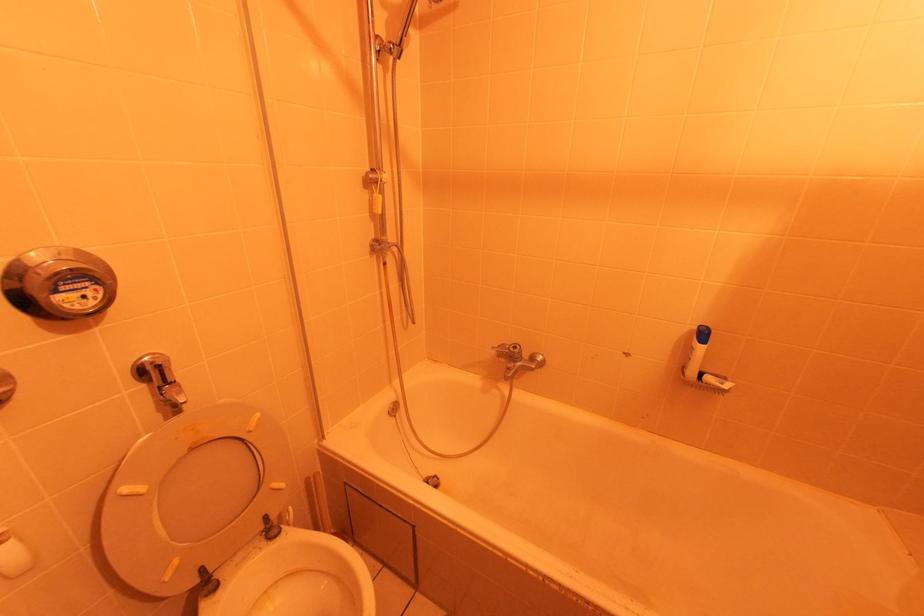
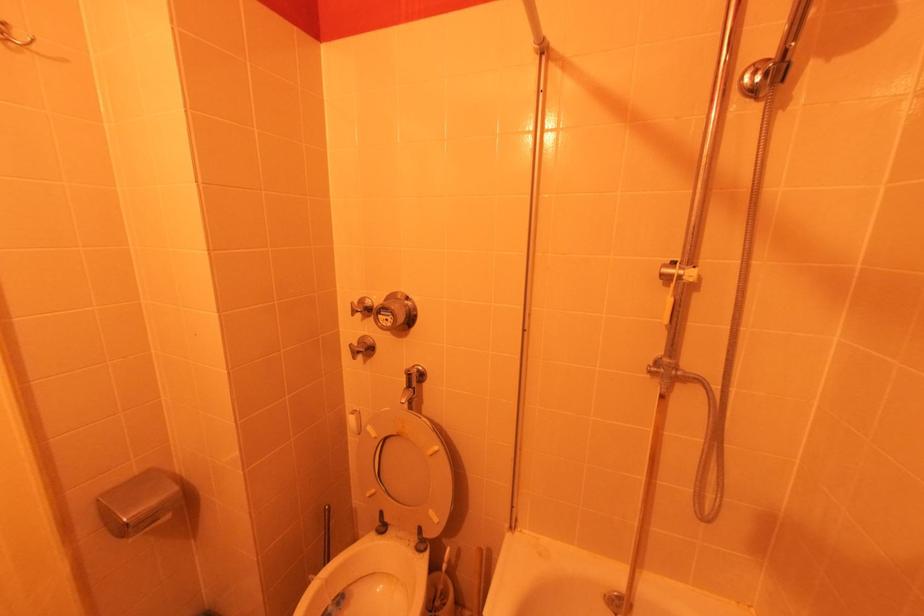
Question: The first image is from the beginning of the video and the second image is from the end. How did the camera likely rotate when shooting the video?

Choices:
 (A) Left
 (B) Right
 (C) Up
 (D) Down

Answer: (A)